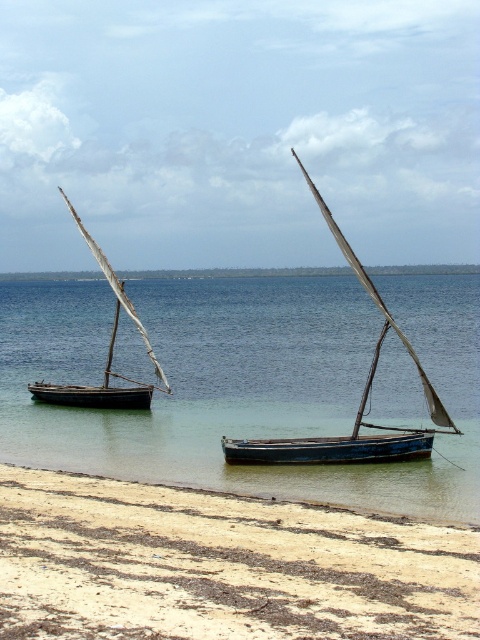
Based on the photo, does clear blue water at center appear over wooden sail at center?

Incorrect, clear blue water at center is not positioned above wooden sail at center.

Looking at this image, is clear blue water at center below wooden sail at center?

Indeed, clear blue water at center is positioned under wooden sail at center.

Which is in front, point (346, 355) or point (447, 429)?

Point (447, 429)

The width and height of the screenshot is (480, 640). Identify the location of clear blue water at center. (244, 381).

Is the position of brown sandy beach at lower left more distant than that of wooden sail at center?

That is False.

Identify the location of brown sandy beach at lower left. (220, 566).

Find the location of `brown sandy beach at lower left`. brown sandy beach at lower left is located at coordinates (220, 566).

Does blue wooden canoe at center have a greater height compared to wooden sailboat at left?

In fact, blue wooden canoe at center may be shorter than wooden sailboat at left.

You are a GUI agent. You are given a task and a screenshot of the screen. Output one action in this format:
    pyautogui.click(x=<x>, y=<y>)
    Task: Click on the blue wooden canoe at center
    This screenshot has width=480, height=640.
    Given the screenshot: What is the action you would take?
    pyautogui.click(x=330, y=449)